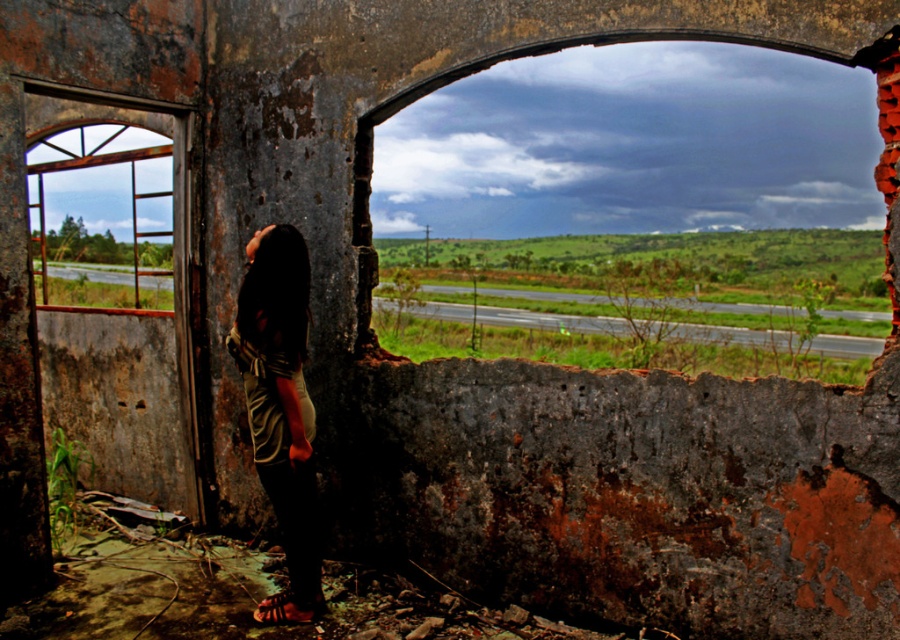
Question: Which point is closer to the camera?

Choices:
 (A) (279, 605)
 (B) (61, 228)
 (C) (300, 320)
 (D) (824, 113)

Answer: (C)

Question: Based on their relative distances, which object is farther from the rusty metal window at left?

Choices:
 (A) leather sandal at lower center
 (B) dark brown fabric dress at center
 (C) rusty concrete arch at upper center

Answer: (C)

Question: Does rusty concrete arch at upper center have a lesser width compared to rusty metal window at left?

Choices:
 (A) yes
 (B) no

Answer: (A)

Question: Estimate the real-world distances between objects in this image. Which object is farther from the leather sandal at lower center?

Choices:
 (A) rusty metal window at left
 (B) dark brown fabric dress at center

Answer: (A)

Question: Is rusty metal window at left thinner than leather sandal at lower center?

Choices:
 (A) yes
 (B) no

Answer: (B)

Question: Can you confirm if rusty metal window at left is smaller than dark brown fabric dress at center?

Choices:
 (A) yes
 (B) no

Answer: (B)